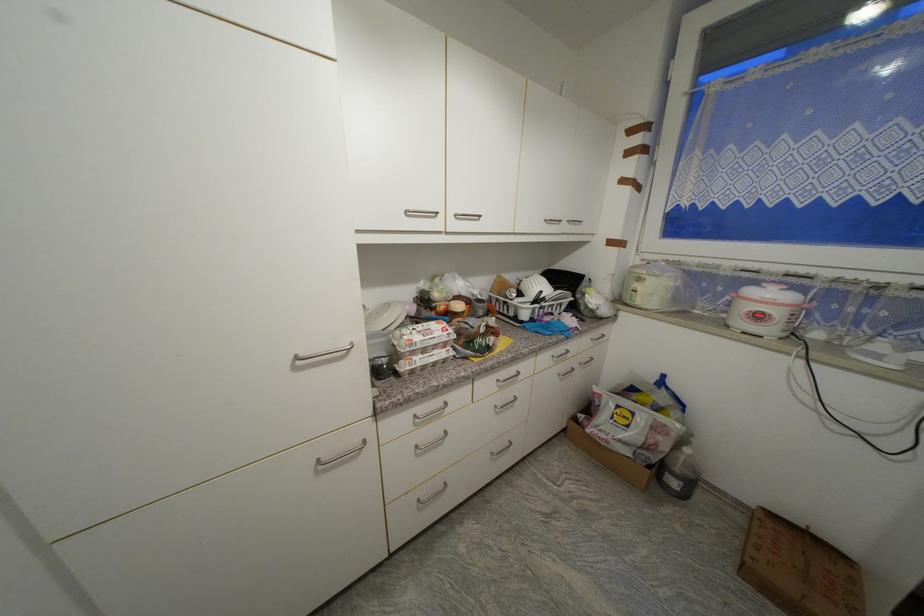
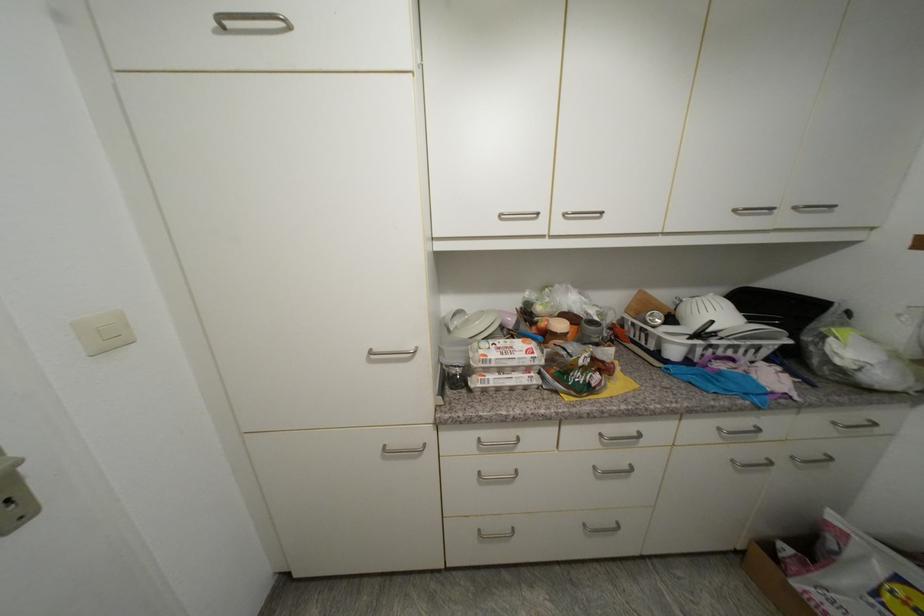
In the second image, find the point that corresponds to point (552, 222) in the first image.

(740, 213)